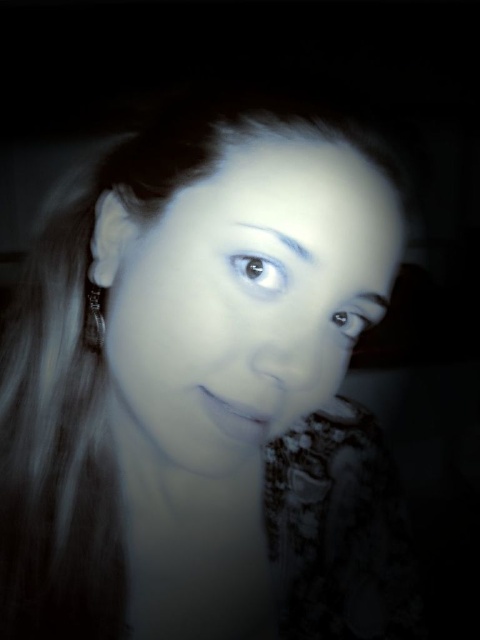
Question: Is smooth skin face at center wider than shiny black eye at center?

Choices:
 (A) yes
 (B) no

Answer: (A)

Question: Observing the image, what is the correct spatial positioning of smooth skin face at center in reference to shiny black eye at upper right?

Choices:
 (A) above
 (B) below

Answer: (A)

Question: Which object is farther from the camera taking this photo?

Choices:
 (A) shiny black eye at upper right
 (B) shiny black eye at center

Answer: (A)

Question: Can you confirm if silver metallic earring at left is positioned above shiny black eye at upper right?

Choices:
 (A) yes
 (B) no

Answer: (A)

Question: Considering the real-world distances, which object is closest to the shiny black eye at center?

Choices:
 (A) shiny black eye at upper right
 (B) smooth skin face at center
 (C) silver metallic earring at left

Answer: (A)

Question: Which object is positioned farthest from the smooth skin face at center?

Choices:
 (A) shiny black eye at upper right
 (B) silver metallic earring at left
 (C) shiny black eye at center

Answer: (B)